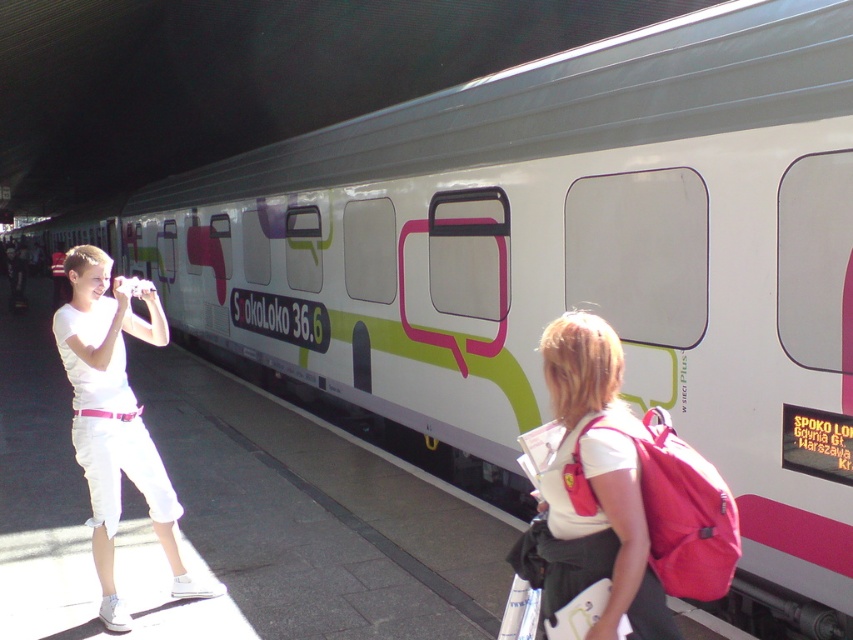
You are a photographer at the train station. You want to take a photo of the white cotton shirt at left and the matte pink backpack at center. Based on their positions, which object should you focus on first to ensure both are in frame?

The matte pink backpack at center is located above the white cotton shirt at left, so you should focus on the white cotton shirt at left first to ensure both are in frame.

You are a photographer at the train station. You want to take a photo of the white cotton shirt at left and the matte pink backpack at center so that both are clearly visible. Based on their positions, which object should be closer to the camera?

The matte pink backpack at center is in front of the white cotton shirt at left, so the backpack should be closer to the camera to ensure both are visible.

You are at the train station and want to place your matte pink backpack at center on the platform. Given the coordinates provided, can you confirm if the backpack is positioned safely away from the edge of the platform?

The matte pink backpack at center is positioned at coordinates point (592, 488), which is safely away from the edge of the platform.